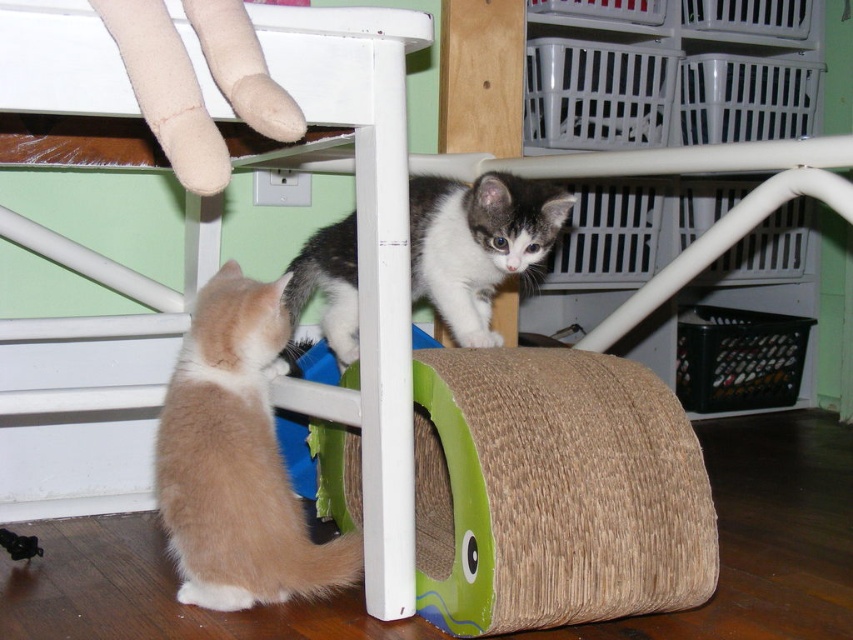
Question: Can you confirm if light brown fur at lower left is positioned to the left of gray-white fur cat at under table?

Choices:
 (A) yes
 (B) no

Answer: (A)

Question: Which point is farther to the camera?

Choices:
 (A) gray-white fur cat at under table
 (B) light brown fur at lower left

Answer: (A)

Question: Does light brown fur at lower left have a larger size compared to gray-white fur cat at under table?

Choices:
 (A) no
 (B) yes

Answer: (A)

Question: Which point appears farthest from the camera in this image?

Choices:
 (A) (256, 534)
 (B) (440, 256)

Answer: (B)

Question: Considering the relative positions of light brown fur at lower left and gray-white fur cat at under table in the image provided, where is light brown fur at lower left located with respect to gray-white fur cat at under table?

Choices:
 (A) above
 (B) below

Answer: (B)